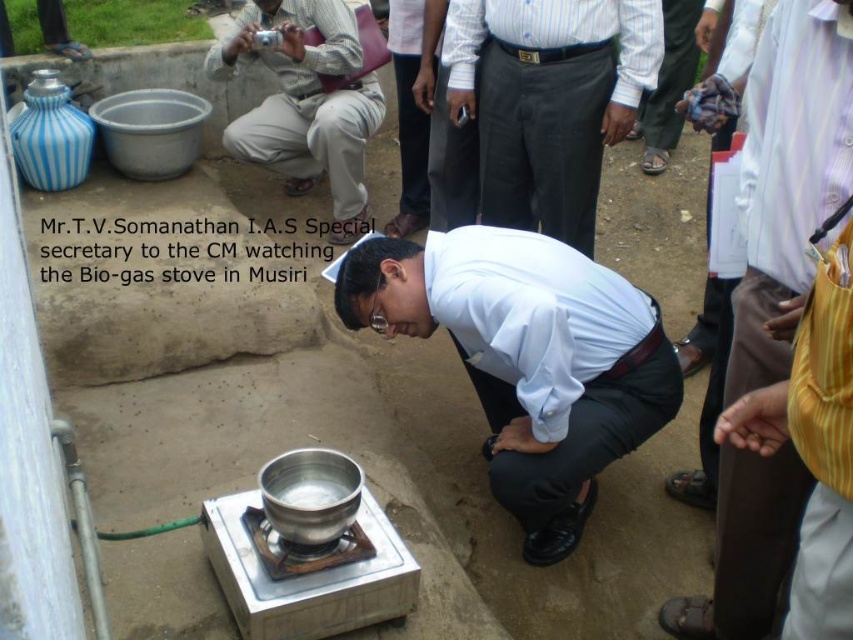
Is shiny metallic pot at center shorter than matte silver camera at upper left?

Yes.

Is shiny metallic pot at center thinner than matte silver camera at upper left?

Incorrect, shiny metallic pot at center's width is not less than matte silver camera at upper left's.

Does point (448, 241) come in front of point (277, 51)?

That is True.

Find the location of `shiny metallic pot at center`. shiny metallic pot at center is located at coordinates (527, 358).

Does shiny metallic pot at center appear under white striped shirt at center?

Yes.

You are a GUI agent. You are given a task and a screenshot of the screen. Output one action in this format:
    pyautogui.click(x=<x>, y=<y>)
    Task: Click on the shiny metallic pot at center
    The image size is (853, 640).
    Given the screenshot: What is the action you would take?
    pyautogui.click(x=527, y=358)

Between point (595, 300) and point (560, 104), which one is positioned in front?

Positioned in front is point (595, 300).

The width and height of the screenshot is (853, 640). I want to click on shiny metallic pot at center, so click(527, 358).

This screenshot has width=853, height=640. What do you see at coordinates (548, 100) in the screenshot?
I see `white striped shirt at center` at bounding box center [548, 100].

Is white striped shirt at center shorter than matte silver camera at upper left?

Correct, white striped shirt at center is not as tall as matte silver camera at upper left.

Measure the distance between point (575, 230) and camera.

Point (575, 230) is 9.70 feet from camera.

Identify the location of white striped shirt at center. The height and width of the screenshot is (640, 853). (548, 100).